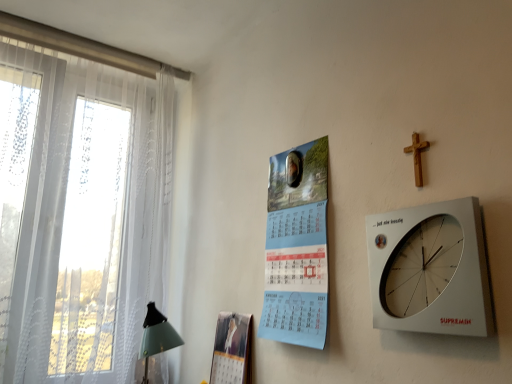
What do you see at coordinates (417, 156) in the screenshot? This screenshot has height=384, width=512. I see `wooden cross at upper right` at bounding box center [417, 156].

Identify the location of white sheer curtain at left. The height and width of the screenshot is (384, 512). (80, 206).

Can you confirm if white plastic wall clock at upper right is smaller than matte paper magazine at center?

Yes, white plastic wall clock at upper right is smaller than matte paper magazine at center.

The height and width of the screenshot is (384, 512). I want to click on wall clock in front of the matte paper magazine at center, so pos(431,269).

Is white plastic wall clock at upper right wider than matte paper magazine at center?

In fact, white plastic wall clock at upper right might be narrower than matte paper magazine at center.

Considering the points (444, 277) and (250, 345), which point is behind, point (444, 277) or point (250, 345)?

Point (250, 345)

Is white sheer curtain at left outside of white plastic wall clock at upper right?

Absolutely, white sheer curtain at left is external to white plastic wall clock at upper right.

Is white sheer curtain at left positioned with its back to white plastic wall clock at upper right?

No, white plastic wall clock at upper right is not at the back of white sheer curtain at left.

Between white sheer curtain at left and white plastic wall clock at upper right, which one has smaller size?

white plastic wall clock at upper right.

In the scene shown: From the image's perspective, which is above, light blue paper calendar at center or white plastic wall clock at upper right?

light blue paper calendar at center is shown above in the image.

Which is in front, point (282, 240) or point (376, 296)?

The point (376, 296) is closer to the camera.

Is white plastic wall clock at upper right at the back of light blue paper calendar at center?

No, light blue paper calendar at center is not facing away from white plastic wall clock at upper right.

Considering the positions of objects light blue paper calendar at center and white plastic wall clock at upper right in the image provided, who is more to the left, light blue paper calendar at center or white plastic wall clock at upper right?

light blue paper calendar at center.

Does matte paper magazine at center turn towards white plastic wall clock at upper right?

No, matte paper magazine at center does not turn towards white plastic wall clock at upper right.

I want to click on magazine below the white plastic wall clock at upper right (from a real-world perspective), so click(232, 349).

Looking at this image, from a real-world perspective, who is located lower, matte paper magazine at center or white plastic wall clock at upper right?

matte paper magazine at center is physically lower.

From the image's perspective, which is below, matte paper magazine at center or white sheer curtain at left?

matte paper magazine at center, from the image's perspective.

Is there a large distance between matte paper magazine at center and white sheer curtain at left?

Actually, matte paper magazine at center and white sheer curtain at left are a little close together.

Who is shorter, light blue paper calendar at center or white sheer curtain at left?

Standing shorter between the two is light blue paper calendar at center.

Which of these two, light blue paper calendar at center or white sheer curtain at left, is wider?

Wider between the two is white sheer curtain at left.

Which object is further away from the camera, light blue paper calendar at center or white sheer curtain at left?

white sheer curtain at left.

Is white sheer curtain at left located outside light blue paper calendar at center?

white sheer curtain at left lies outside light blue paper calendar at center's area.

Is white sheer curtain at left turned away from light blue paper calendar at center?

That's not correct — white sheer curtain at left is not looking away from light blue paper calendar at center.

Considering the sizes of white sheer curtain at left and light blue paper calendar at center in the image, is white sheer curtain at left taller or shorter than light blue paper calendar at center?

Clearly, white sheer curtain at left is taller compared to light blue paper calendar at center.

Where is `wall clock that appears above the matte paper magazine at center (from the image's perspective)`? wall clock that appears above the matte paper magazine at center (from the image's perspective) is located at coordinates (431, 269).

The height and width of the screenshot is (384, 512). I want to click on window located on the left of white plastic wall clock at upper right, so click(80, 206).

Which object lies further to the anchor point matte paper magazine at center, white plastic wall clock at upper right or light blue paper calendar at center?

white plastic wall clock at upper right is positioned further to the anchor matte paper magazine at center.

Based on their spatial positions, is matte paper magazine at center or white sheer curtain at left closer to wooden cross at upper right?

matte paper magazine at center is positioned closer to the anchor wooden cross at upper right.

Looking at the image, which one is located closer to matte paper magazine at center, light blue paper calendar at center or wooden cross at upper right?

light blue paper calendar at center is positioned closer to the anchor matte paper magazine at center.

Based on their spatial positions, is wooden cross at upper right or matte paper magazine at center further from light blue paper calendar at center?

wooden cross at upper right is positioned further to the anchor light blue paper calendar at center.

Which object lies further to the anchor point matte paper magazine at center, white sheer curtain at left or wooden cross at upper right?

Based on the image, wooden cross at upper right appears to be further to matte paper magazine at center.

Based on their spatial positions, is matte paper magazine at center or wooden cross at upper right closer to white plastic wall clock at upper right?

wooden cross at upper right lies closer to white plastic wall clock at upper right than the other object.

Considering their positions, is matte paper magazine at center positioned further to light blue paper calendar at center than wooden cross at upper right?

wooden cross at upper right is further to light blue paper calendar at center.

Estimate the real-world distances between objects in this image. Which object is further from wooden cross at upper right, white sheer curtain at left or white plastic wall clock at upper right?

Based on the image, white sheer curtain at left appears to be further to wooden cross at upper right.

This screenshot has width=512, height=384. What are the coordinates of `poster page between white sheer curtain at left and wooden cross at upper right in the horizontal direction` in the screenshot? It's located at (297, 247).

Find the location of `poster page between white sheer curtain at left and white plastic wall clock at upper right`. poster page between white sheer curtain at left and white plastic wall clock at upper right is located at coordinates (297, 247).

The image size is (512, 384). Identify the location of magazine between white sheer curtain at left and wooden cross at upper right. (232, 349).

This screenshot has height=384, width=512. Find the location of `wall clock situated between white sheer curtain at left and wooden cross at upper right from left to right`. wall clock situated between white sheer curtain at left and wooden cross at upper right from left to right is located at coordinates (431, 269).